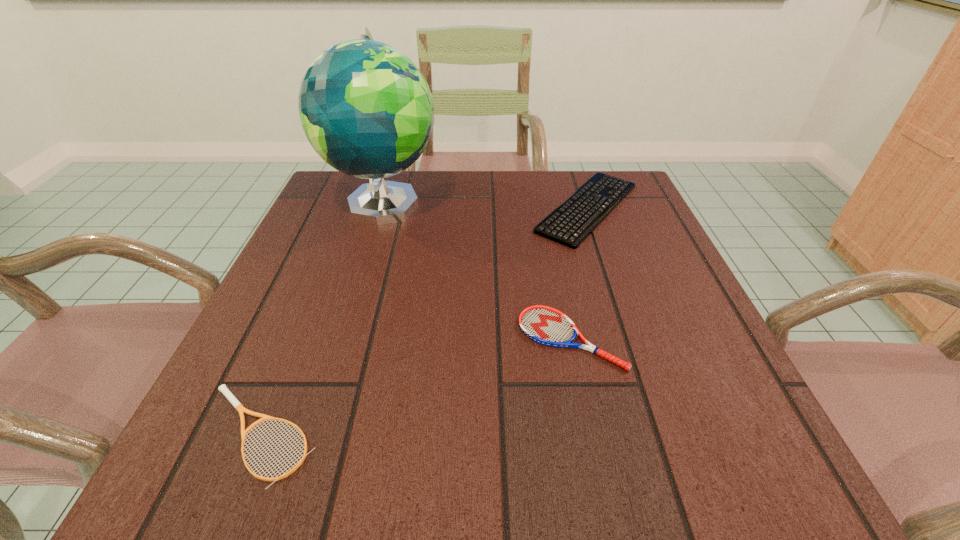
Find the location of `globe`. globe is located at coordinates (366, 109).

Image resolution: width=960 pixels, height=540 pixels. What are the coordinates of `computer keyboard` in the screenshot? It's located at (565, 224).

Where is `the farther tennis racket`? Image resolution: width=960 pixels, height=540 pixels. the farther tennis racket is located at coordinates (545, 325).

Locate an element on the screen. The width and height of the screenshot is (960, 540). the right tennis racket is located at coordinates (545, 325).

At what (x,y) coordinates should I click in order to perform the action: click on the nearer tennis racket. Please return your answer as a coordinate pair (x, y). Looking at the image, I should click on (238, 406).

This screenshot has width=960, height=540. I want to click on the nearest object, so click(x=238, y=406).

Identify the location of vacant area situated 0.360m on the front surface of the tallest object. The height and width of the screenshot is (540, 960). (x=330, y=379).

Image resolution: width=960 pixels, height=540 pixels. In order to click on vacant space located on the left of the computer keyboard in this screenshot , I will do `click(487, 208)`.

Find the location of a particular element. This screenshot has width=960, height=540. blank space located on the back of the farther tennis racket is located at coordinates (545, 214).

At what (x,y) coordinates should I click in order to perform the action: click on free region located 0.170m on the back of the nearer tennis racket. Please return your answer as a coordinate pair (x, y). Looking at the image, I should click on (311, 307).